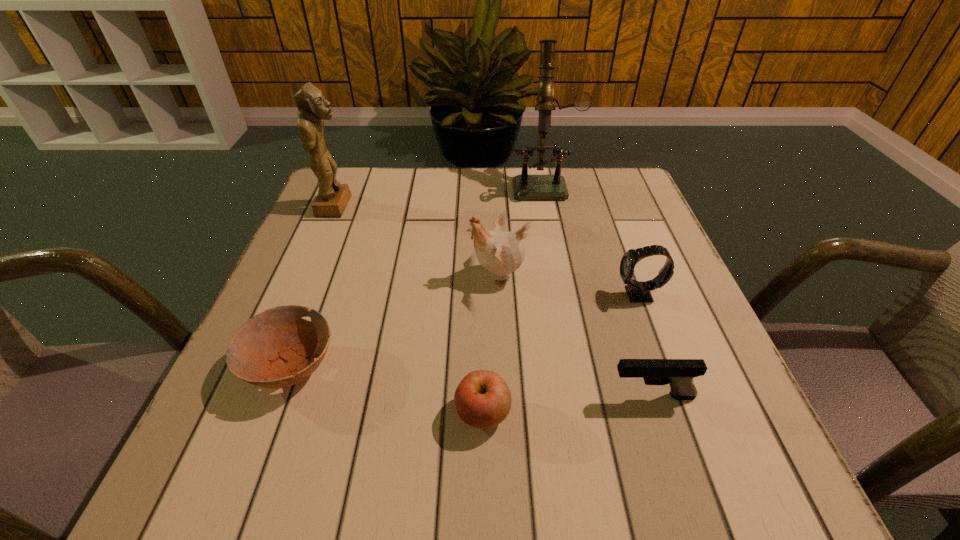
Identify the location of microscope. Image resolution: width=960 pixels, height=540 pixels. (525, 187).

Identify the location of figurine. The height and width of the screenshot is (540, 960). (332, 198).

At what (x,y) coordinates should I click in order to perform the action: click on bird. Please return your answer as a coordinate pair (x, y). The height and width of the screenshot is (540, 960). Looking at the image, I should click on (500, 252).

The image size is (960, 540). In order to click on the fourth shortest object in this screenshot , I will do `click(638, 291)`.

You are a GUI agent. You are given a task and a screenshot of the screen. Output one action in this format:
    pyautogui.click(x=<x>, y=<y>)
    Task: Click on the pistol
    Image resolution: width=960 pixels, height=540 pixels.
    Given the screenshot: What is the action you would take?
    pyautogui.click(x=678, y=373)

Where is `apple`? This screenshot has width=960, height=540. apple is located at coordinates (483, 400).

Find the location of a particular element. This screenshot has height=540, width=960. bowl is located at coordinates (270, 350).

The width and height of the screenshot is (960, 540). Find the location of `vacant space located 0.200m at the eyepiece of the microscope`. vacant space located 0.200m at the eyepiece of the microscope is located at coordinates (558, 252).

The width and height of the screenshot is (960, 540). Identify the location of free space located on the front-facing side of the figurine. (465, 206).

Locate an element on the screen. The width and height of the screenshot is (960, 540). vacant space positioned 0.270m at the beak of the bird is located at coordinates (338, 275).